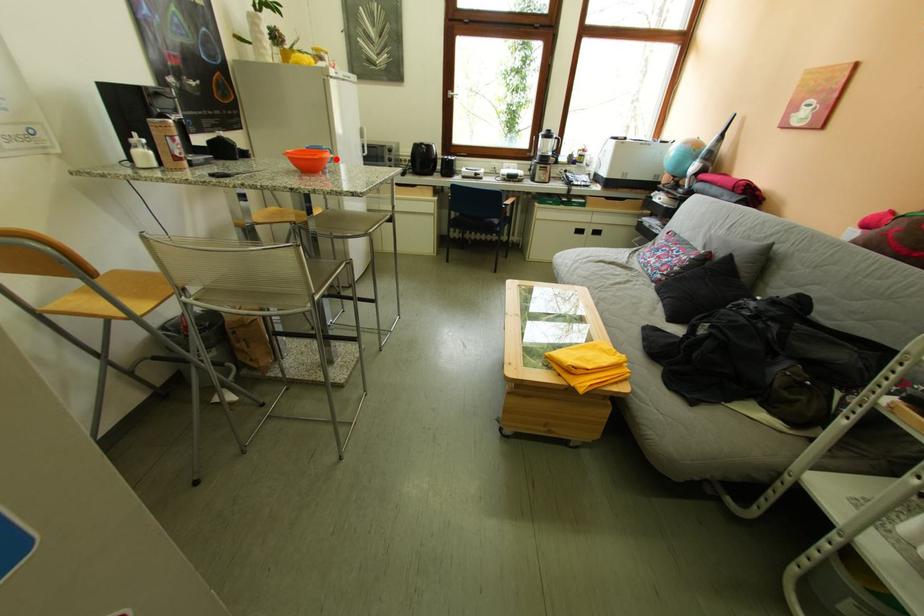
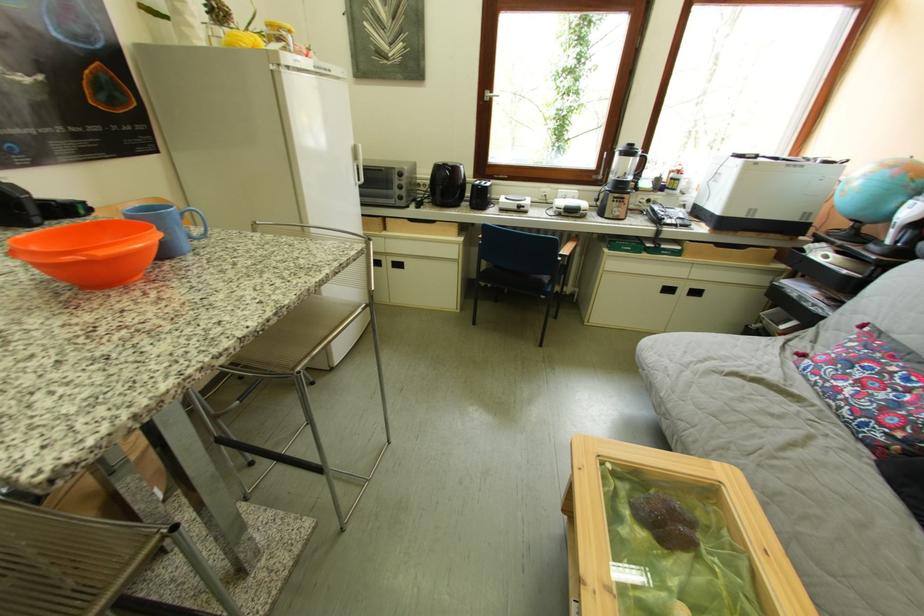
The point at the highlighted location is marked in the first image. Where is the corresponding point in the second image?

(116, 256)